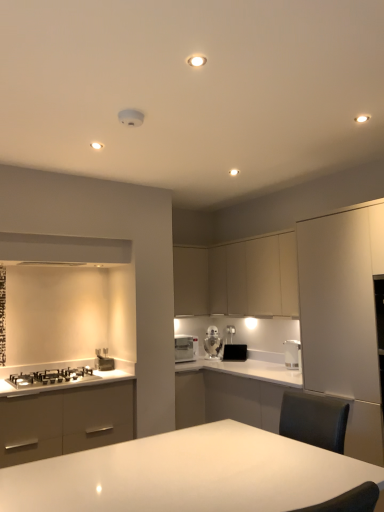
Question: Which is correct: white glossy microwave at center, positioned as the 1th kitchen appliance in left-to-right order, is inside satin silver toaster at lower left, the 1th appliance from the front, or outside of it?

Choices:
 (A) inside
 (B) outside

Answer: (B)

Question: Considering the positions of white glossy microwave at center, which ranks as the 3th kitchen appliance in right-to-left order, and satin silver toaster at lower left, the 1th appliance from the front, in the image, is white glossy microwave at center, which ranks as the 3th kitchen appliance in right-to-left order, wider or thinner than satin silver toaster at lower left, the 1th appliance from the front,?

Choices:
 (A) thin
 (B) wide

Answer: (B)

Question: Estimate the real-world distances between objects in this image. Which object is farther from the white glossy countertop at lower left?

Choices:
 (A) white glossy table at center
 (B) white glossy toaster at center, which is the third kitchen appliance in front-to-back order
 (C) black matte toaster at center, marked as the second appliance in a left-to-right arrangement
 (D) matte beige cabinet at center, the 3th cabinetry positioned from the front
 (E) satin silver toaster at lower left, positioned as the 1th appliance in left-to-right order

Answer: (A)

Question: Which of these objects is positioned closest to the white glossy microwave at center, which is the second kitchen appliance from back to front?

Choices:
 (A) black matte toaster at center, which is the 2th appliance in front-to-back order
 (B) satin silver kettle at right, the 1th kitchen appliance from the front
 (C) matte white cabinets at upper center, acting as the second cabinetry starting from the back
 (D) white glossy table at center
 (E) satin silver toaster at lower left, which is the second appliance in back-to-front order

Answer: (A)